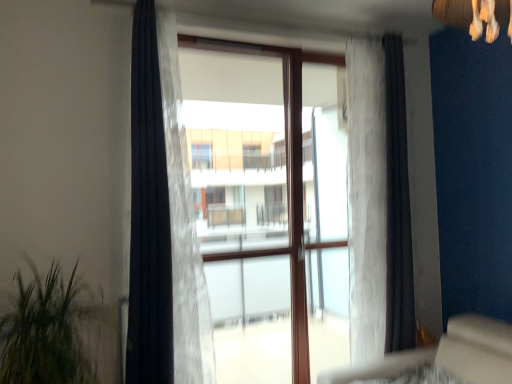
Question: Is black sheer curtain at left, positioned as the 1th curtain in left-to-right order, next to black fabric curtain at right, which appears as the 1th curtain when viewed from the right?

Choices:
 (A) no
 (B) yes

Answer: (A)

Question: Is black sheer curtain at left, positioned as the 1th curtain in left-to-right order, further to camera compared to black fabric curtain at right, which appears as the 1th curtain when viewed from the right?

Choices:
 (A) no
 (B) yes

Answer: (A)

Question: Is black sheer curtain at left, positioned as the 1th curtain in left-to-right order, at the right side of black fabric curtain at right, which appears as the 1th curtain when viewed from the right?

Choices:
 (A) no
 (B) yes

Answer: (A)

Question: Is black sheer curtain at left, which is the fourth curtain in right-to-left order, thinner than black fabric curtain at right, the fourth curtain viewed from the left?

Choices:
 (A) yes
 (B) no

Answer: (B)

Question: Considering the relative sizes of black sheer curtain at left, positioned as the 1th curtain in left-to-right order, and black fabric curtain at right, which appears as the 1th curtain when viewed from the right, in the image provided, is black sheer curtain at left, positioned as the 1th curtain in left-to-right order, bigger than black fabric curtain at right, which appears as the 1th curtain when viewed from the right,?

Choices:
 (A) no
 (B) yes

Answer: (B)

Question: From a real-world perspective, is transparent glass door at center positioned above or below white sheer curtain at center, the third curtain positioned from the left?

Choices:
 (A) above
 (B) below

Answer: (B)

Question: In the image, is transparent glass door at center on the left side or the right side of white sheer curtain at center, the third curtain positioned from the left?

Choices:
 (A) left
 (B) right

Answer: (A)

Question: Relative to white sheer curtain at center, the third curtain positioned from the left, is transparent glass door at center in front or behind?

Choices:
 (A) behind
 (B) front

Answer: (B)

Question: Based on their sizes in the image, would you say transparent glass door at center is bigger or smaller than white sheer curtain at center, the second curtain in the right-to-left sequence?

Choices:
 (A) big
 (B) small

Answer: (A)

Question: From their relative heights in the image, would you say black fabric curtain at right, the fourth curtain viewed from the left, is taller or shorter than white sheer curtain at center, the second curtain in the right-to-left sequence?

Choices:
 (A) short
 (B) tall

Answer: (A)

Question: Is point pos(402,188) positioned closer to the camera than point pos(377,137)?

Choices:
 (A) closer
 (B) farther

Answer: (A)

Question: Relative to white sheer curtain at center, the third curtain positioned from the left, is black fabric curtain at right, the fourth curtain viewed from the left, in front or behind?

Choices:
 (A) front
 (B) behind

Answer: (B)

Question: From a real-world perspective, is black fabric curtain at right, the fourth curtain viewed from the left, above or below white sheer curtain at center, the third curtain positioned from the left?

Choices:
 (A) above
 (B) below

Answer: (A)

Question: From a real-world perspective, is black sheer curtain at left, which is the fourth curtain in right-to-left order, above or below black fabric curtain at right, the fourth curtain viewed from the left?

Choices:
 (A) above
 (B) below

Answer: (A)

Question: Considering the positions of black sheer curtain at left, positioned as the 1th curtain in left-to-right order, and black fabric curtain at right, the fourth curtain viewed from the left, in the image, is black sheer curtain at left, positioned as the 1th curtain in left-to-right order, taller or shorter than black fabric curtain at right, the fourth curtain viewed from the left,?

Choices:
 (A) short
 (B) tall

Answer: (A)